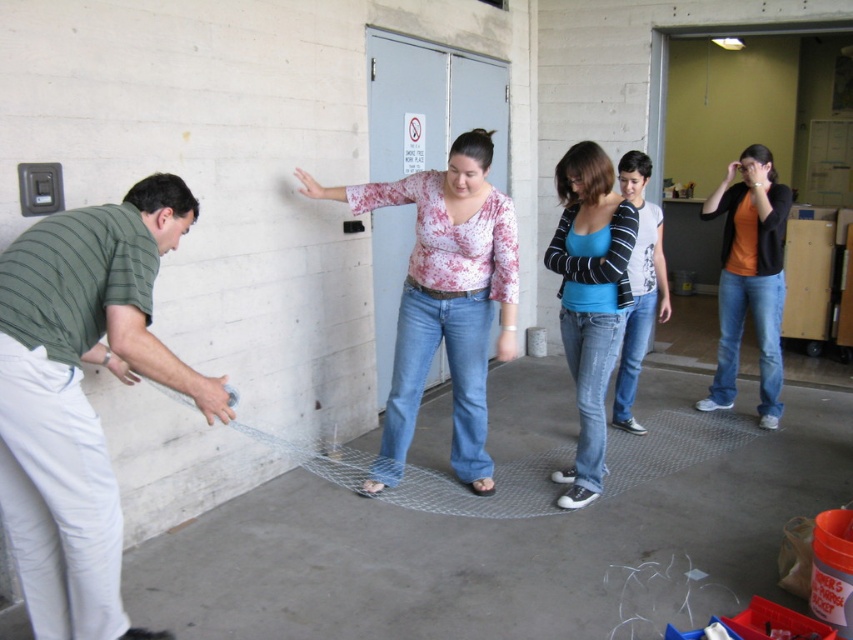
You are a delivery person who needs to place a package between the floral print blouse at center and the orange matte shirt at right. The package is 6 feet long. Will it fit between them?

The floral print blouse at center is 6.09 feet away from the orange matte shirt at right. Since the package is 6 feet long, it will fit between them with a small amount of space remaining.

You are standing at the center of the warehouse and want to move towards the green striped shirt at left. Which direction should you go?

Since the green striped shirt at left is located at point 0.620 on the x and 0.096 on the y coordinates, you should move towards the left side of the warehouse to reach it.

You are a safety inspector in the warehouse. You need to ensure that the green striped shirt at left and the blue cotton shirt at center are within a 2 meter safety distance. Can they safely stand at their current positions?

The green striped shirt at left and the blue cotton shirt at center are 1.75 meters apart from each other, which is within the 2 meter safety distance requirement. Therefore, they can safely stand at their current positions.